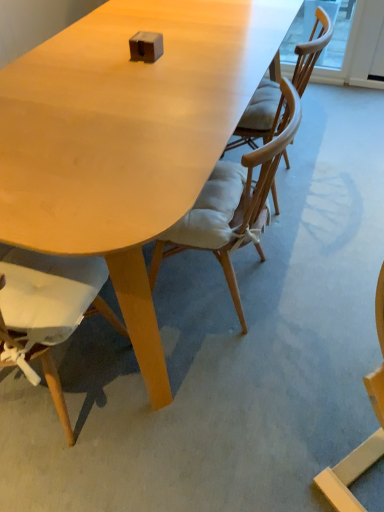
Question: Looking at their shapes, would you say matte wood table at center is wider or thinner than matte wood chair at lower left, the first chair from the left?

Choices:
 (A) thin
 (B) wide

Answer: (B)

Question: Which is correct: matte wood table at center is inside matte wood chair at lower left, marked as the third chair in a right-to-left arrangement, or outside of it?

Choices:
 (A) inside
 (B) outside

Answer: (B)

Question: Which is farther from the wooden chair with cushion at center, placed as the 1th chair when sorted from right to left?

Choices:
 (A) matte wood table at center
 (B) matte wood chair at lower left, marked as the third chair in a right-to-left arrangement
 (C) light brown wood chair at center, which is counted as the 2th chair, starting from the right

Answer: (B)

Question: Which object is positioned farthest from the matte wood chair at lower left, marked as the third chair in a right-to-left arrangement?

Choices:
 (A) matte wood table at center
 (B) light brown wood chair at center, which is counted as the second chair, starting from the left
 (C) wooden chair with cushion at center, positioned as the third chair in left-to-right order

Answer: (C)